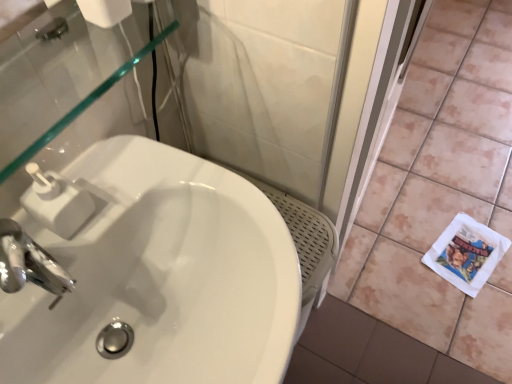
Where is `free space above white paper at lower right (from a real-world perspective)`? free space above white paper at lower right (from a real-world perspective) is located at coordinates (472, 250).